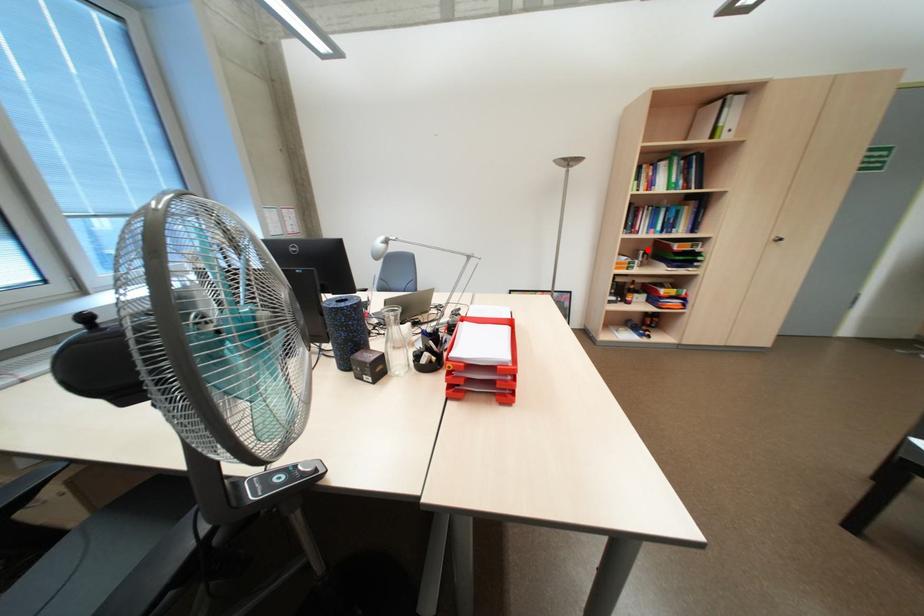
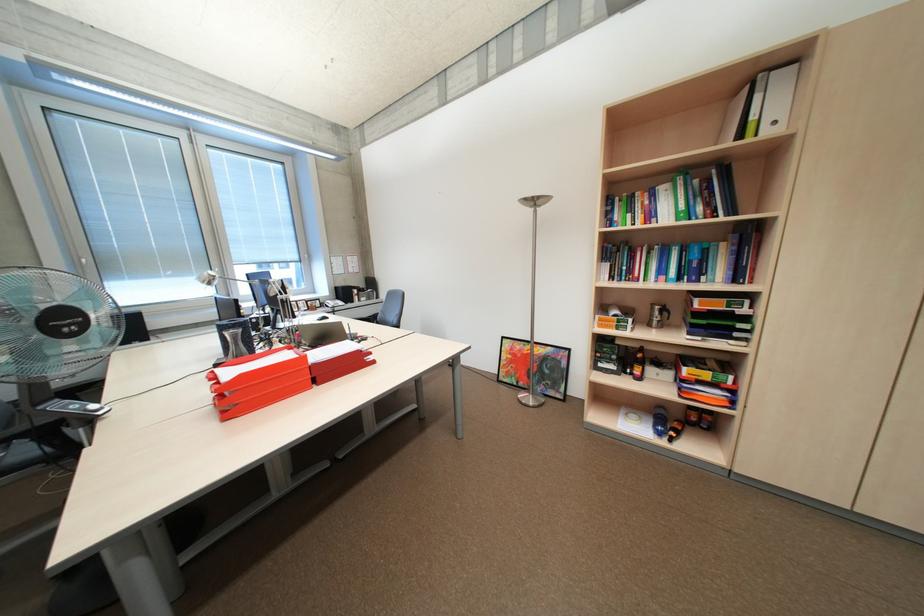
Find the pixel in the second image that matches the highlighted location in the first image.

(663, 304)